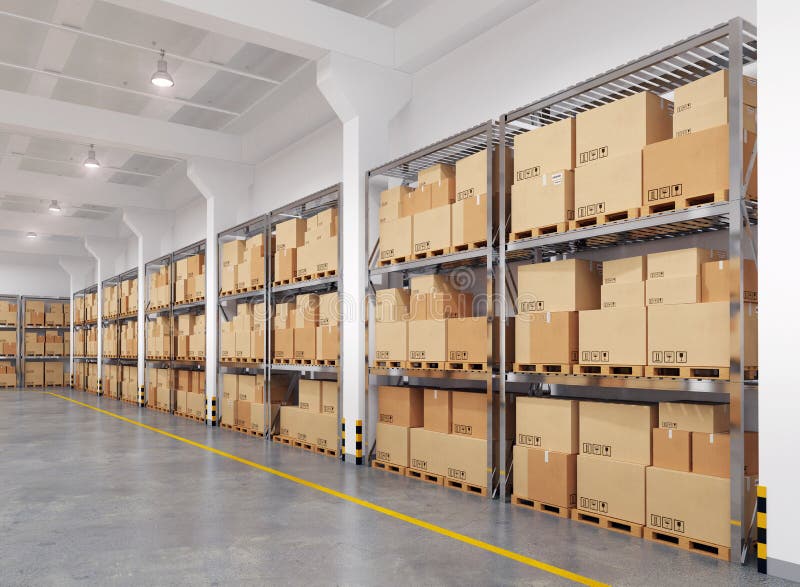
You are a GUI agent. You are given a task and a screenshot of the screen. Output one action in this format:
    pyautogui.click(x=<x>, y=<y>)
    Task: Click on the light
    Image resolution: width=800 pixels, height=587 pixels.
    Given the screenshot: What is the action you would take?
    pyautogui.click(x=156, y=84), pyautogui.click(x=86, y=168), pyautogui.click(x=48, y=215), pyautogui.click(x=30, y=239)